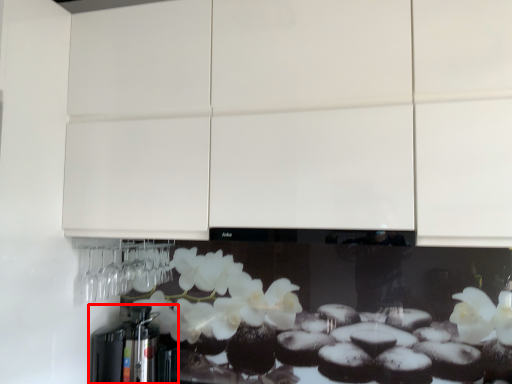
Question: From the image's perspective, what is the correct spatial positioning of coffee machine (annotated by the red box) in reference to cabinetry?

Choices:
 (A) below
 (B) above

Answer: (A)